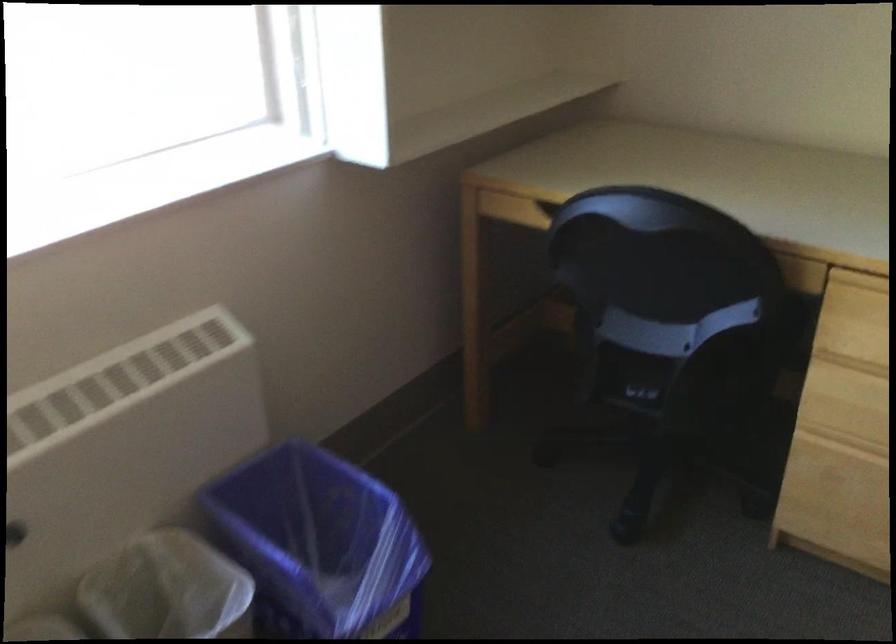
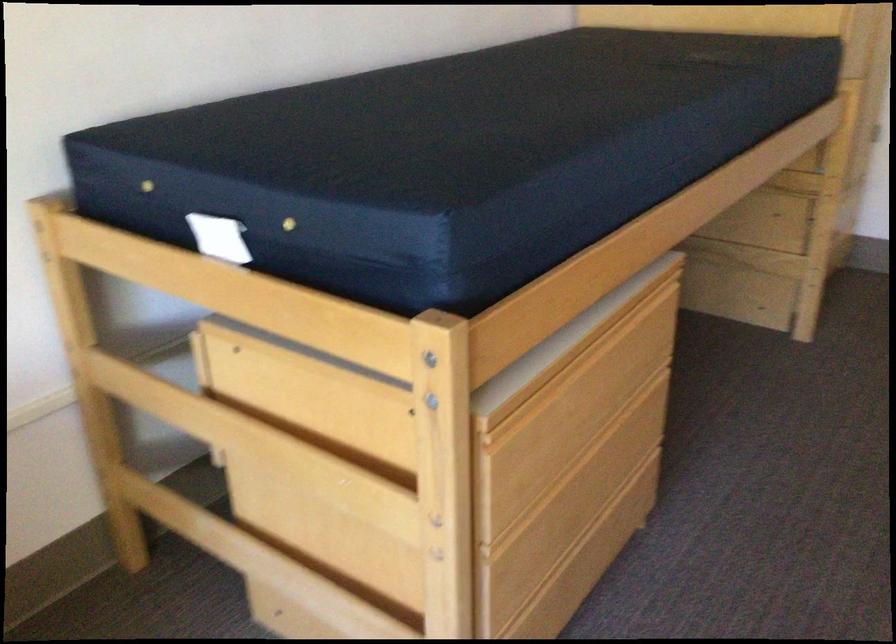
First-person continuous shooting, in which direction is the camera rotating?

The rotation direction of the camera is right-down.